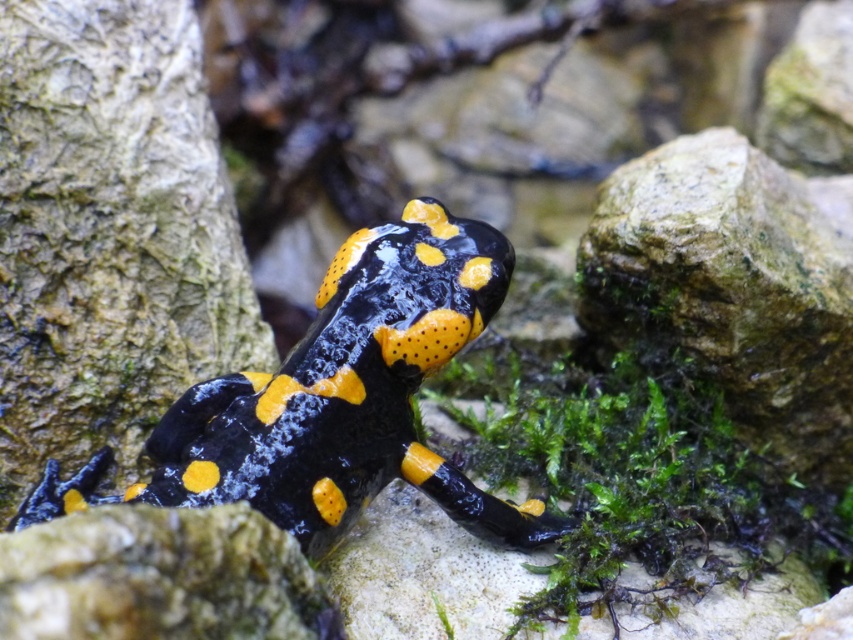
Question: Which object is farther from the camera taking this photo?

Choices:
 (A) black matte salamander at center
 (B) green mossy rock at center right
 (C) smooth rock at lower center

Answer: (B)

Question: Considering the real-world distances, which object is farthest from the black matte salamander at center?

Choices:
 (A) green mossy rock at center right
 (B) smooth rock at lower center

Answer: (A)

Question: Among these points, which one is farthest from the camera?

Choices:
 (A) tap(338, 612)
 (B) tap(465, 280)

Answer: (B)

Question: Does black matte salamander at center have a larger size compared to smooth rock at lower center?

Choices:
 (A) yes
 (B) no

Answer: (A)

Question: Is black matte salamander at center smaller than smooth rock at lower center?

Choices:
 (A) no
 (B) yes

Answer: (A)

Question: Can you confirm if green mossy rock at center right is positioned to the right of smooth rock at lower center?

Choices:
 (A) no
 (B) yes

Answer: (B)